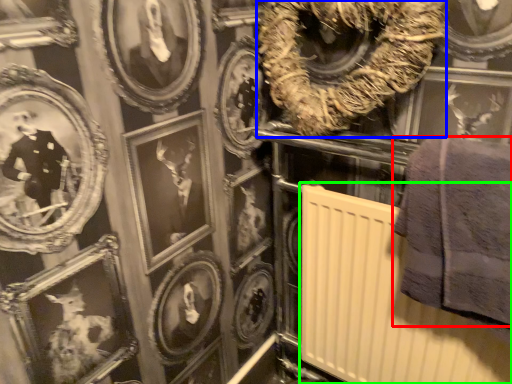
Question: Estimate the real-world distances between objects in this image. Which object is farther from towel (highlighted by a red box), decor (highlighted by a blue box) or radiator (highlighted by a green box)?

Choices:
 (A) decor
 (B) radiator

Answer: (A)